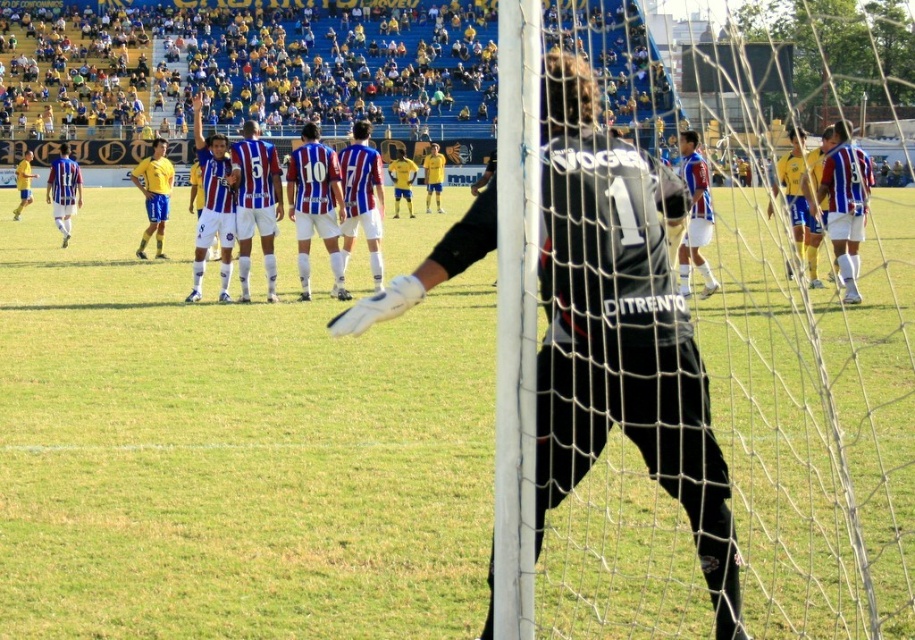
Question: Can you confirm if green grass at center is wider than striped jersey at right?

Choices:
 (A) no
 (B) yes

Answer: (B)

Question: From the image, what is the correct spatial relationship of green grass at center in relation to striped jersey at right?

Choices:
 (A) below
 (B) above

Answer: (A)

Question: Can you confirm if white mesh net at center is positioned to the left of striped jersey at right?

Choices:
 (A) yes
 (B) no

Answer: (B)

Question: Which point is closer to the camera?

Choices:
 (A) (797, 324)
 (B) (81, 202)
 (C) (587, 4)

Answer: (A)

Question: Which of the following is the farthest from the observer?

Choices:
 (A) (693, 264)
 (B) (52, 182)
 (C) (863, 204)
 (D) (184, 621)

Answer: (B)

Question: Which object is the farthest from the blue striped jersey at center?

Choices:
 (A) blue and white striped jersey at left
 (B) white mesh net at center

Answer: (B)